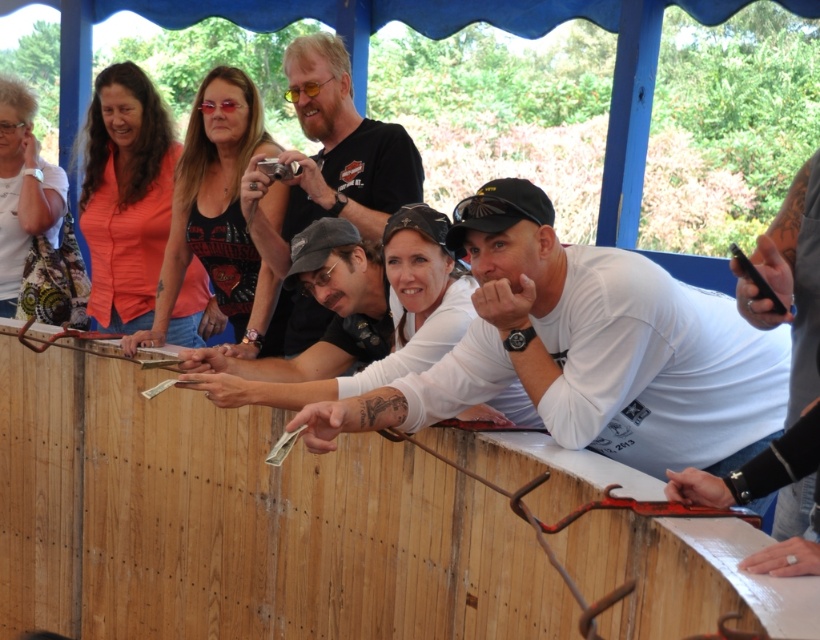
Does wooden fence at center come behind white printed shirt at upper left?

No, it is not.

Is wooden fence at center wider than white printed shirt at upper left?

Indeed, wooden fence at center has a greater width compared to white printed shirt at upper left.

Locate an element on the screen. wooden fence at center is located at coordinates (239, 522).

Consider the image. Is black matte t-shirt at center wider than white printed shirt at upper left?

A: Yes, black matte t-shirt at center is wider than white printed shirt at upper left.

Is black matte t-shirt at center shorter than white printed shirt at upper left?

Yes.

Between point (304, 156) and point (30, 209), which one is positioned behind?

The point (30, 209) is more distant.

Image resolution: width=820 pixels, height=640 pixels. Identify the location of black matte t-shirt at center. (331, 156).

Is wooden fence at center to the left of black matte t-shirt at center from the viewer's perspective?

Indeed, wooden fence at center is positioned on the left side of black matte t-shirt at center.

Is wooden fence at center taller than black matte t-shirt at center?

Yes, wooden fence at center is taller than black matte t-shirt at center.

Between point (410, 611) and point (299, 74), which one is positioned in front?

Point (410, 611)

Locate an element on the screen. This screenshot has height=640, width=820. wooden fence at center is located at coordinates (239, 522).